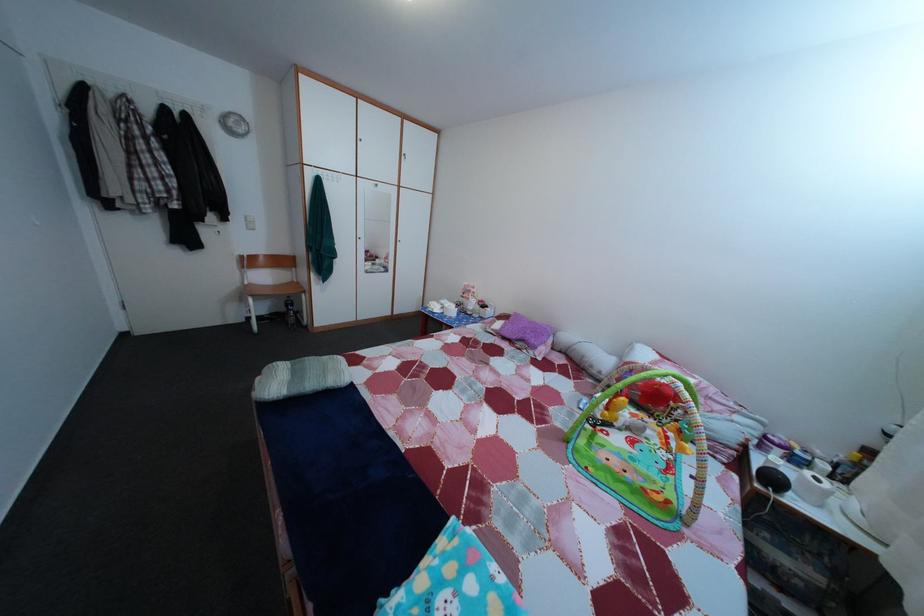
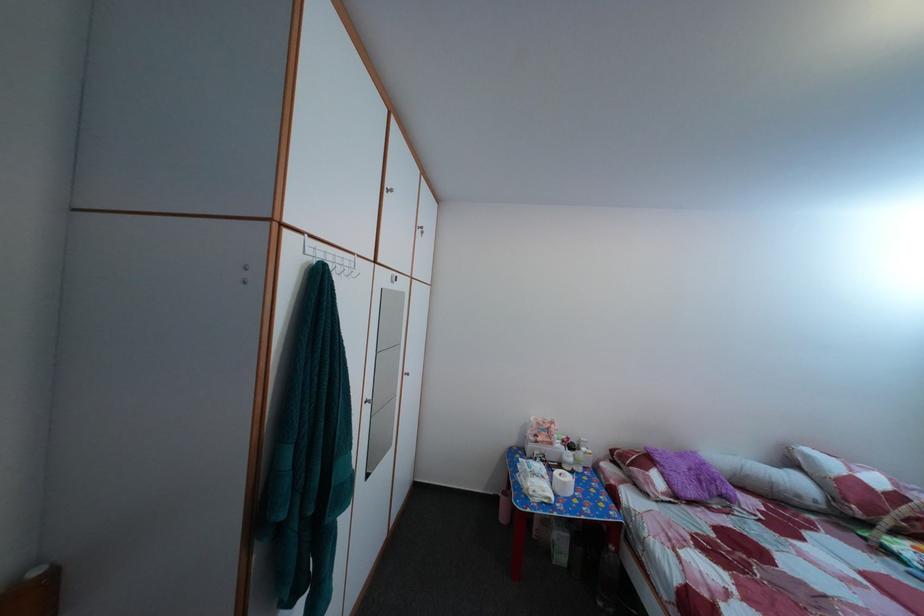
Where in the second image is the point corresponding to point 601,374 from the first image?

(808, 504)